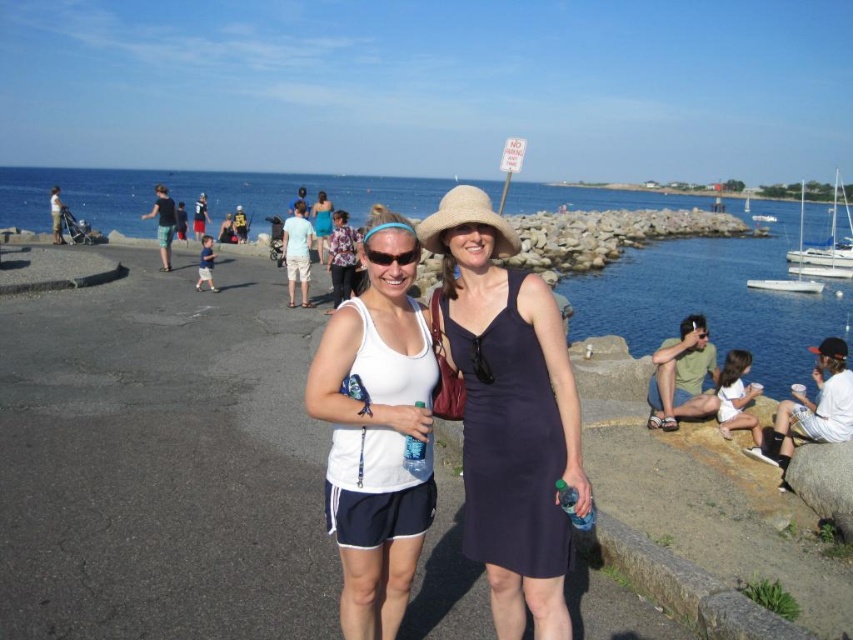
Question: Among these points, which one is farthest from the camera?

Choices:
 (A) (846, 257)
 (B) (509, 435)
 (C) (376, 522)
 (D) (793, 282)

Answer: (A)

Question: Can you confirm if white glossy sailboat at right is wider than black plastic sunglasses at center?

Choices:
 (A) yes
 (B) no

Answer: (A)

Question: Is white matte tank top at center bigger than black plastic sunglasses at center?

Choices:
 (A) yes
 (B) no

Answer: (A)

Question: Which object is positioned closest to the white sailboat at right?

Choices:
 (A) navy satin dress at center
 (B) black plastic sunglasses at center
 (C) white glossy sailboat at right
 (D) white matte tank top at center

Answer: (C)

Question: Does navy satin dress at center appear under white sailboat at right?

Choices:
 (A) yes
 (B) no

Answer: (A)

Question: Which point is farther to the camera?

Choices:
 (A) (804, 198)
 (B) (840, 246)
 (C) (517, 291)
 (D) (383, 612)

Answer: (A)